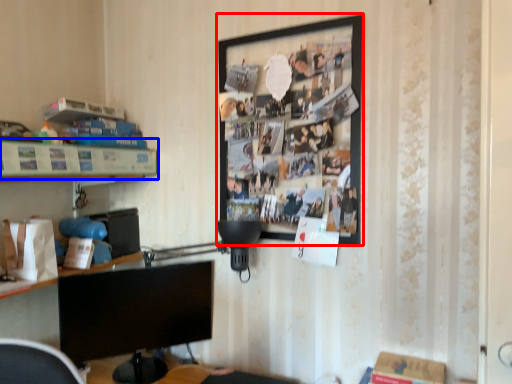
Question: Which object appears farthest to the camera in this image, picture frame (highlighted by a red box) or shelf (highlighted by a blue box)?

Choices:
 (A) picture frame
 (B) shelf

Answer: (A)